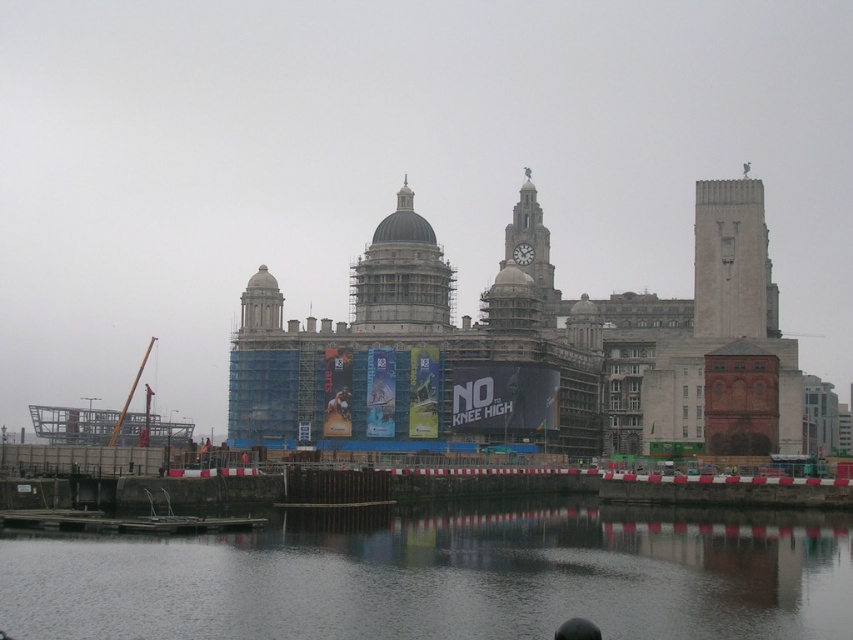
You are an architect evaluating the waterfront scene. You need to determine which object, the smooth concrete tower at upper right or the gray stone dome at center, has a greater width for structural analysis. Based on the scene, which one is wider?

The smooth concrete tower at upper right has a greater width than the gray stone dome at center according to the description provided.

You are standing at the waterfront and want to take a photo of the historic building with its reflection on the smooth dark water at lower center. Based on the coordinates provided, is the water surface at the correct position to capture the reflection clearly?

The smooth dark water at lower center is located at point (x=444, y=577), which should be the ideal position to capture the reflection of the historic building clearly as the coordinates align with the water surface location.

In the scene shown: You are a construction worker assessing the building site. You notice the smooth concrete tower at upper right and the gray stone dome at center. Which structure is taller?

The smooth concrete tower at upper right is taller than the gray stone dome at center according to the description.